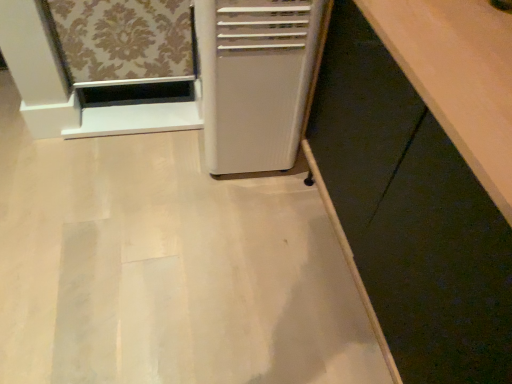
The image size is (512, 384). What are the coordinates of `white plastic air conditioner at center` in the screenshot? It's located at [x=255, y=79].

The height and width of the screenshot is (384, 512). Describe the element at coordinates (255, 79) in the screenshot. I see `white plastic air conditioner at center` at that location.

What do you see at coordinates (411, 215) in the screenshot? I see `matte white cabinet at lower right` at bounding box center [411, 215].

Where is `matte white cabinet at lower right`? matte white cabinet at lower right is located at coordinates (411, 215).

This screenshot has height=384, width=512. Find the location of `white plastic air conditioner at center`. white plastic air conditioner at center is located at coordinates (255, 79).

Is white plastic air conditioner at center to the right of matte white cabinet at lower right from the viewer's perspective?

In fact, white plastic air conditioner at center is to the left of matte white cabinet at lower right.

Does white plastic air conditioner at center come in front of matte white cabinet at lower right?

No, it is not.

Is point (199, 54) less distant than point (441, 171)?

That is False.

From the image's perspective, between white plastic air conditioner at center and matte white cabinet at lower right, which one is located above?

white plastic air conditioner at center, from the image's perspective.

From a real-world perspective, which object stands above the other?

matte white cabinet at lower right.

Can you confirm if white plastic air conditioner at center is wider than matte white cabinet at lower right?

In fact, white plastic air conditioner at center might be narrower than matte white cabinet at lower right.

In the scene shown: Considering the sizes of objects white plastic air conditioner at center and matte white cabinet at lower right in the image provided, who is shorter, white plastic air conditioner at center or matte white cabinet at lower right?

white plastic air conditioner at center is shorter.

Which of these two, white plastic air conditioner at center or matte white cabinet at lower right, is smaller?

white plastic air conditioner at center.

Is white plastic air conditioner at center inside the boundaries of matte white cabinet at lower right, or outside?

white plastic air conditioner at center is outside matte white cabinet at lower right.

Is white plastic air conditioner at center not close to matte white cabinet at lower right?

No, white plastic air conditioner at center is not far from matte white cabinet at lower right.

Consider the image. Is white plastic air conditioner at center facing towards matte white cabinet at lower right?

No, white plastic air conditioner at center is not facing towards matte white cabinet at lower right.

Can you tell me how much white plastic air conditioner at center and matte white cabinet at lower right differ in facing direction?

There is a 86.3-degree angle between the facing directions of white plastic air conditioner at center and matte white cabinet at lower right.

In order to click on home appliance below the matte white cabinet at lower right (from a real-world perspective) in this screenshot , I will do `click(255, 79)`.

In the image, is matte white cabinet at lower right on the left side or the right side of white plastic air conditioner at center?

matte white cabinet at lower right is positioned on white plastic air conditioner at center's right side.

Which object is closer to the camera taking this photo, matte white cabinet at lower right or white plastic air conditioner at center?

Positioned in front is matte white cabinet at lower right.

Which is less distant, (511, 243) or (203, 109)?

The point (511, 243) is more forward.

From the image's perspective, does matte white cabinet at lower right appear higher than white plastic air conditioner at center?

No.

From a real-world perspective, is matte white cabinet at lower right physically below white plastic air conditioner at center?

No.

Is matte white cabinet at lower right wider than white plastic air conditioner at center?

Correct, the width of matte white cabinet at lower right exceeds that of white plastic air conditioner at center.

Who is shorter, matte white cabinet at lower right or white plastic air conditioner at center?

With less height is white plastic air conditioner at center.

Who is smaller, matte white cabinet at lower right or white plastic air conditioner at center?

white plastic air conditioner at center is smaller.

Is matte white cabinet at lower right located outside white plastic air conditioner at center?

Indeed, matte white cabinet at lower right is completely outside white plastic air conditioner at center.

In the scene shown: Can you see matte white cabinet at lower right touching white plastic air conditioner at center?

No, matte white cabinet at lower right is not touching white plastic air conditioner at center.

Could you tell me if matte white cabinet at lower right is turned towards white plastic air conditioner at center?

No, matte white cabinet at lower right does not turn towards white plastic air conditioner at center.

How far apart are matte white cabinet at lower right and white plastic air conditioner at center?

matte white cabinet at lower right is 14.50 inches from white plastic air conditioner at center.

Identify the location of cabinetry below the white plastic air conditioner at center (from the image's perspective). The height and width of the screenshot is (384, 512). [411, 215].

Locate an element on the screen. This screenshot has height=384, width=512. cabinetry above the white plastic air conditioner at center (from a real-world perspective) is located at coordinates (411, 215).

The height and width of the screenshot is (384, 512). What are the coordinates of `cabinetry below the white plastic air conditioner at center (from the image's perspective)` in the screenshot? It's located at (411, 215).